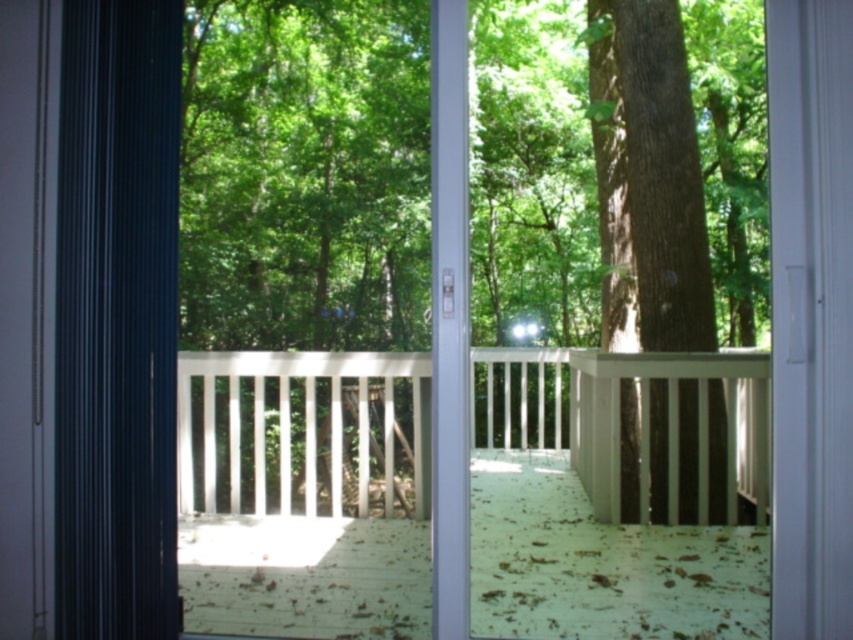
Question: Where is white wooden porch at center located in relation to brown rough bark tree at center in the image?

Choices:
 (A) right
 (B) left

Answer: (B)

Question: Which object is the closest to the white wooden porch at center?

Choices:
 (A) brown rough bark tree at center
 (B) black fabric curtain at left

Answer: (A)

Question: Estimate the real-world distances between objects in this image. Which object is farther from the brown rough bark tree at center?

Choices:
 (A) white wooden porch at center
 (B) black fabric curtain at left

Answer: (B)

Question: Is black fabric curtain at left thinner than brown rough bark tree at center?

Choices:
 (A) no
 (B) yes

Answer: (B)

Question: Which of the following is the closest to the observer?

Choices:
 (A) (602, 100)
 (B) (737, 426)

Answer: (B)

Question: In this image, where is white wooden porch at center located relative to brown rough bark tree at center?

Choices:
 (A) above
 (B) below

Answer: (B)